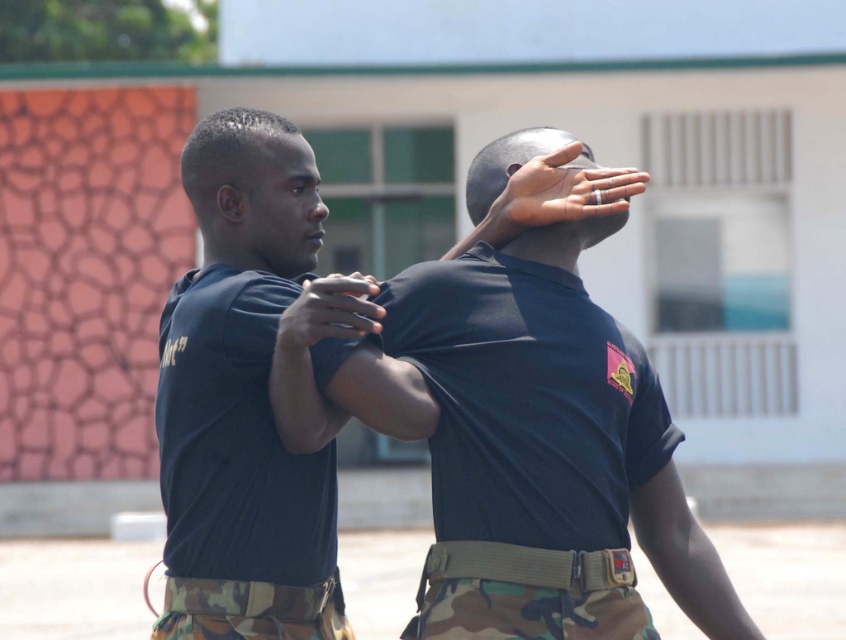
You are a photographer trying to capture a closeup of the person on the right. You are currently at the position of point (199, 280). To get a better shot, you want to move closer to the person on the right. Should you move towards point (551, 154) or away from it?

You should move away from point (551, 154) because point (199, 280) is closer to the camera than point (551, 154). Moving away from point (551, 154) would bring you closer to the person on the right.

Looking at this image, you are a photographer trying to capture the scene from the current viewpoint. The black matte shirt at center is represented by point (551, 416). Where should you position your camera to ensure the black matte shirt at center is centered in the frame?

To center the black matte shirt at center, position the camera so the point (551, 416) is at the frame center.